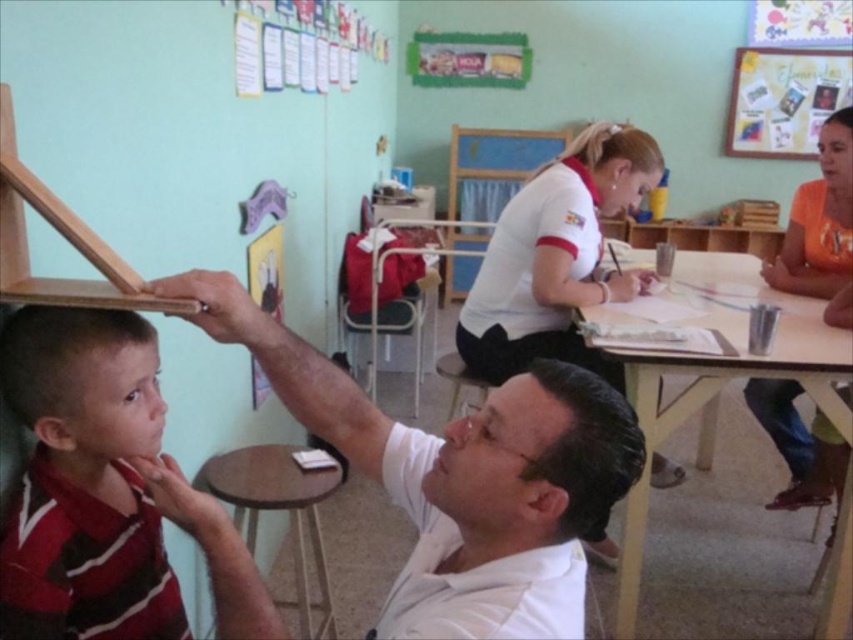
You are a student in the classroom and need to place a 15 cm tall textbook on the wooden table at center. Can the textbook fit on the table if the orange cotton shirt at right is already placed there?

The wooden table at center is taller than orange cotton shirt at right, so the textbook can be placed on the wooden table at center as the table has sufficient height to accommodate both the shirt and the textbook.

You are a student who needs to choose between placing a 10cm thick textbook on either the light brown wood easel at upper left or the wooden round table at center. Based on their thickness, which surface can support the textbook?

The wooden round table at center is thicker than the light brown wood easel at upper left. Therefore, the wooden round table at center can support the 10cm thick textbook better.